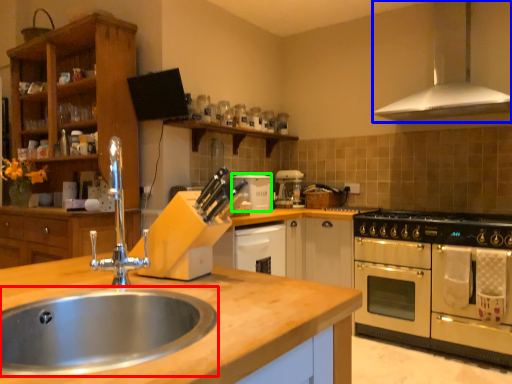
Question: Which is farther away from sink (highlighted by a red box)? exhaust hood (highlighted by a blue box) or appliance (highlighted by a green box)?

Choices:
 (A) exhaust hood
 (B) appliance

Answer: (A)